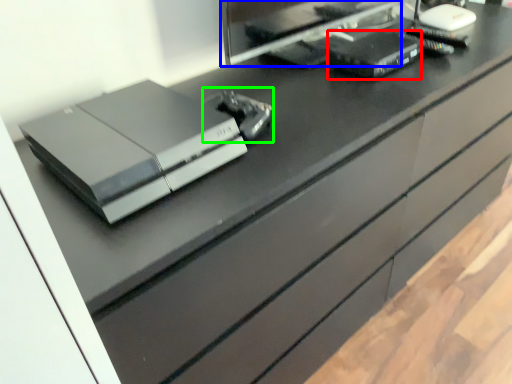
Question: Considering the real-world distances, which object is farthest from equipment (highlighted by a red box)? desktop computer (highlighted by a blue box) or equipment (highlighted by a green box)?

Choices:
 (A) desktop computer
 (B) equipment

Answer: (B)